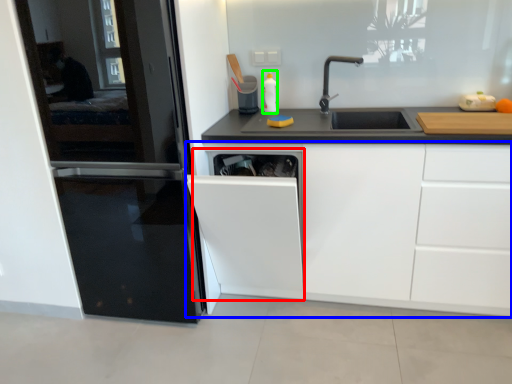
Question: Which is farther away from dish washer (highlighted by a red box)? cabinetry (highlighted by a blue box) or bottle (highlighted by a green box)?

Choices:
 (A) cabinetry
 (B) bottle

Answer: (B)